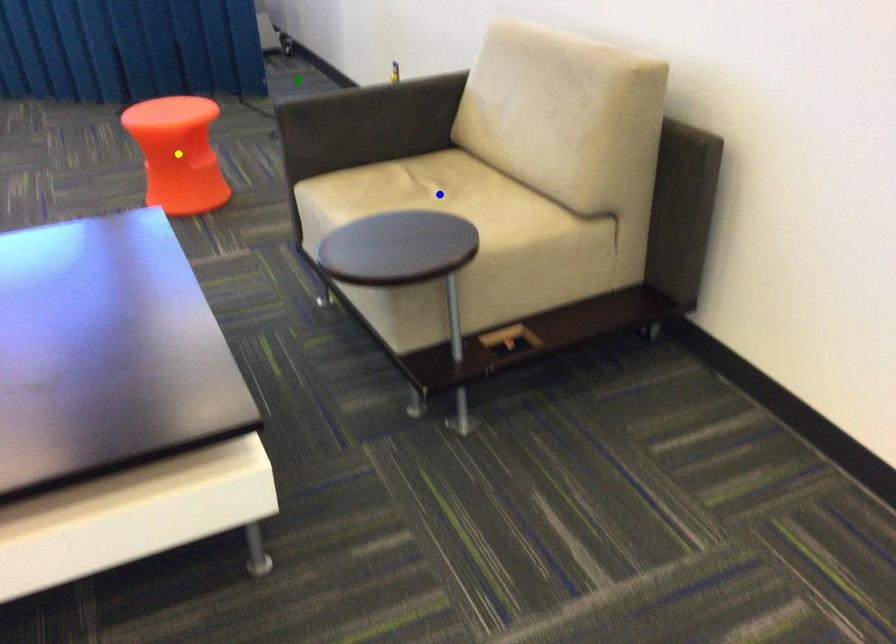
Order these from nearest to farthest:
yellow point, blue point, green point

blue point < yellow point < green point